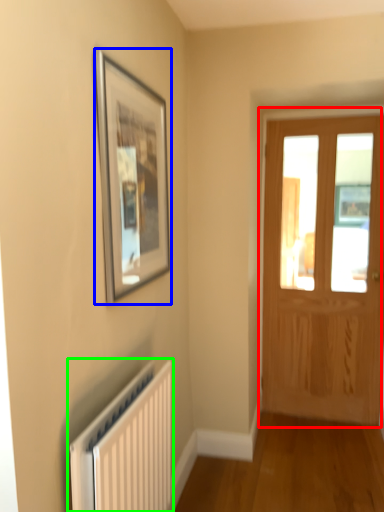
Question: Which object is positioned farthest from door (highlighted by a red box)? Select from picture frame (highlighted by a blue box) and radiator (highlighted by a green box).

Choices:
 (A) picture frame
 (B) radiator

Answer: (B)